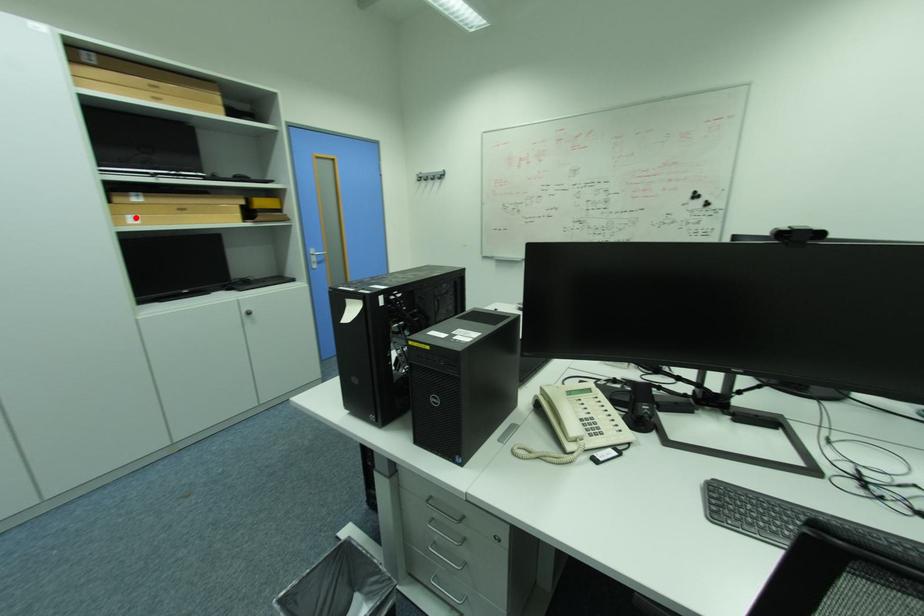
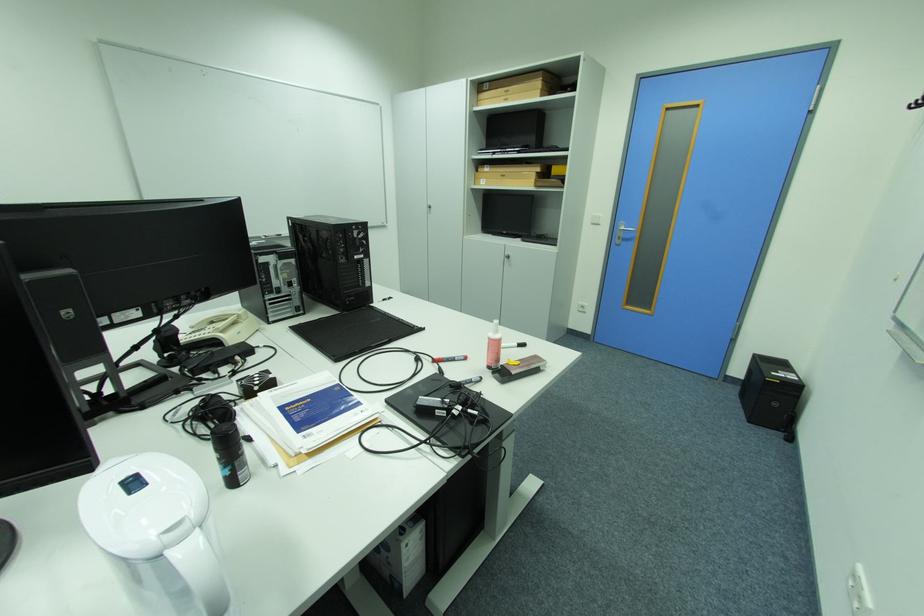
Locate, in the second image, the point that corresponds to the highlighted location in the first image.

(490, 180)